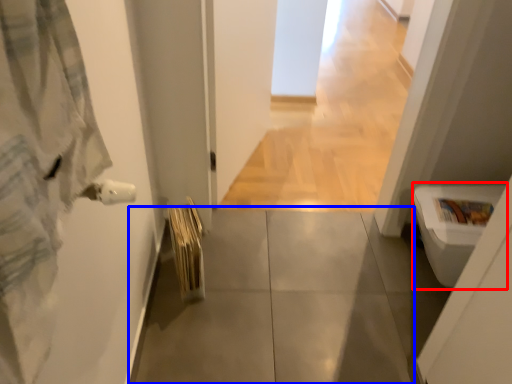
Question: Which point is closer to the camera, toilet bowl (highlighted by a red box) or concrete (highlighted by a blue box)?

Choices:
 (A) toilet bowl
 (B) concrete

Answer: (A)